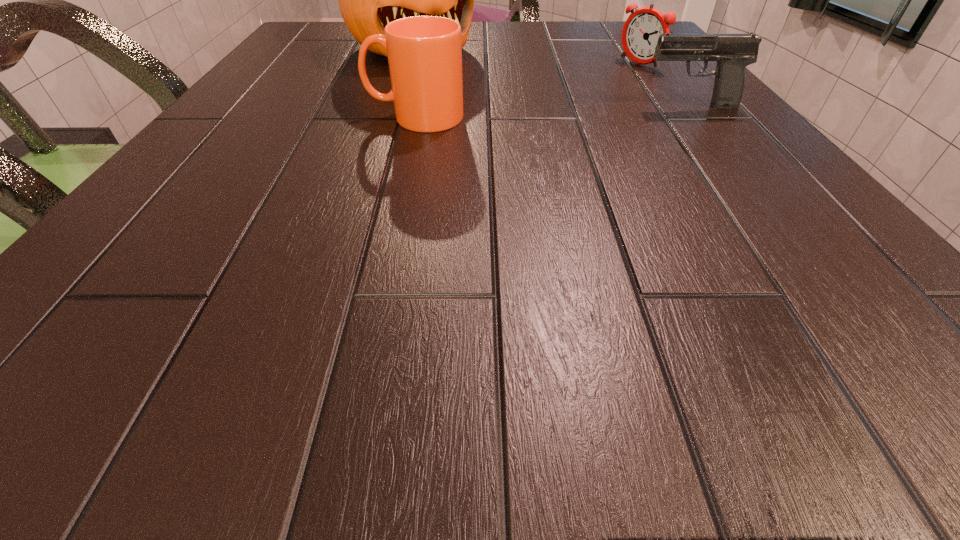
This screenshot has width=960, height=540. Find the location of `free space on the desktop that is between the third shortest object and the pistol and is positioned on the face of the pumpkin`. free space on the desktop that is between the third shortest object and the pistol and is positioned on the face of the pumpkin is located at coordinates (516, 113).

This screenshot has height=540, width=960. Identify the location of vacant space on the desktop that is between the mug and the pistol and is positioned on the front-facing side of the alarm clock. (533, 112).